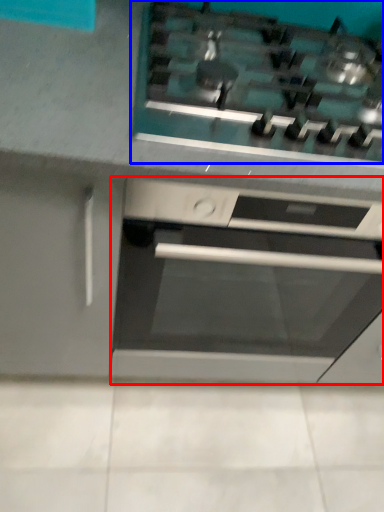
Question: Which object is further to the camera taking this photo, home appliance (highlighted by a red box) or gas stove (highlighted by a blue box)?

Choices:
 (A) home appliance
 (B) gas stove

Answer: (A)